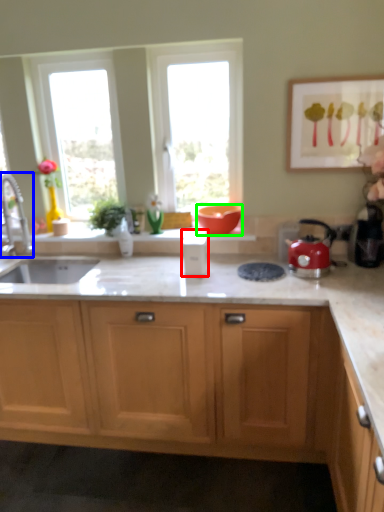
Question: Estimate the real-world distances between objects in this image. Which object is closer to appliance (highlighted by a red box), tap (highlighted by a blue box) or flowerpot (highlighted by a green box)?

Choices:
 (A) tap
 (B) flowerpot

Answer: (B)